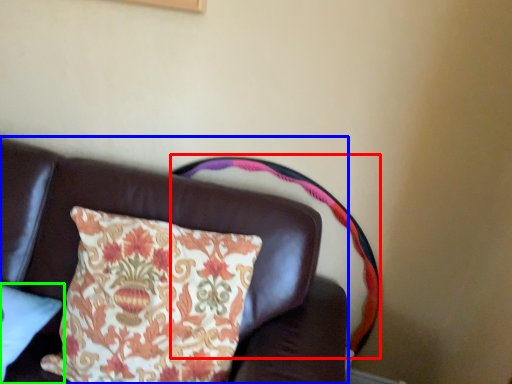
Question: Which object is positioned closest to swivel chair (highlighted by a red box)? Select from furniture (highlighted by a blue box) and pillow (highlighted by a green box).

Choices:
 (A) furniture
 (B) pillow

Answer: (A)